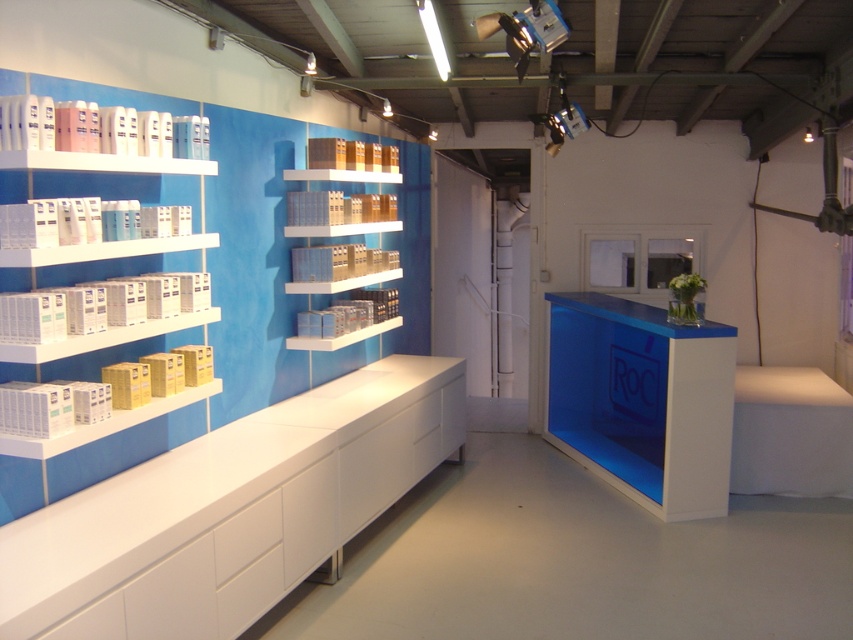
Question: Which object is positioned closest to the white glossy boxes at left?

Choices:
 (A) white glossy cabinet at lower left
 (B) white plastic boxes at left
 (C) blue glossy counter at center

Answer: (B)

Question: Which point is closer to the camera taking this photo?

Choices:
 (A) (339, 170)
 (B) (171, 173)
 (C) (114, 620)
 (D) (160, 243)

Answer: (C)

Question: Observing the image, what is the correct spatial positioning of white plastic boxes at left in reference to white glossy shelves at center?

Choices:
 (A) above
 (B) below

Answer: (B)

Question: Can you confirm if white glossy cabinet at lower left is positioned to the left of blue glossy counter at center?

Choices:
 (A) yes
 (B) no

Answer: (A)

Question: Does white plastic boxes at left appear on the right side of white glossy shelves at center?

Choices:
 (A) yes
 (B) no

Answer: (B)

Question: Which object is the closest to the white glossy cabinet at lower left?

Choices:
 (A) white glossy boxes at left
 (B) white plastic boxes at left
 (C) blue glossy counter at center

Answer: (B)